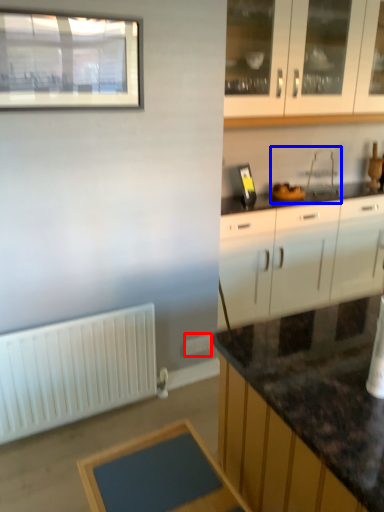
Question: Which point is further to the camera, electric outlet (highlighted by a red box) or sink (highlighted by a blue box)?

Choices:
 (A) electric outlet
 (B) sink

Answer: (B)